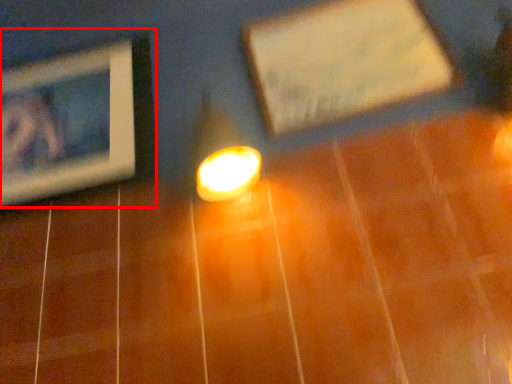
Question: In this image, where is picture frame (annotated by the red box) located relative to picture frame?

Choices:
 (A) left
 (B) right

Answer: (A)